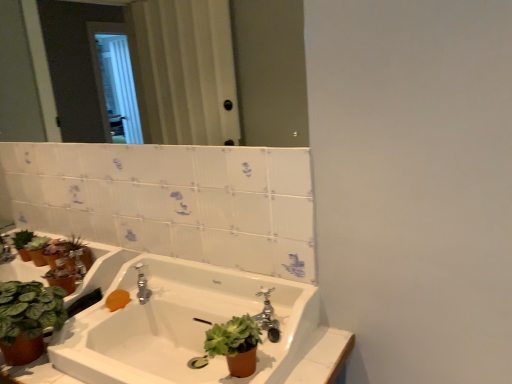
Image resolution: width=512 pixels, height=384 pixels. In order to click on green matte succulent at lower center in this screenshot , I will do `click(232, 345)`.

What are the coordinates of `orange matte soap at lower left` in the screenshot? It's located at (117, 300).

Who is shorter, white glossy sink at center or green matte succulent at lower center?

Standing shorter between the two is green matte succulent at lower center.

From a real-world perspective, which object rests below the other?

white glossy sink at center, from a real-world perspective.

Between white glossy sink at center and green matte succulent at lower center, which one has smaller width?

green matte succulent at lower center.

From a real-world perspective, does green matte succulent at lower center sit lower than orange matte soap at lower left?

No, from a real-world perspective, green matte succulent at lower center is not under orange matte soap at lower left.

Can you confirm if green matte succulent at lower center is wider than orange matte soap at lower left?

Yes, green matte succulent at lower center is wider than orange matte soap at lower left.

Does green matte succulent at lower center lie behind orange matte soap at lower left?

Result: No, it is in front of orange matte soap at lower left.

Which point is more distant from viewer, (234, 318) or (121, 302)?

The point (121, 302) is farther.

In terms of size, does orange matte soap at lower left appear bigger or smaller than clear glass mirror at upper center?

Clearly, orange matte soap at lower left is smaller in size than clear glass mirror at upper center.

Considering the points (106, 306) and (25, 129), which point is in front, point (106, 306) or point (25, 129)?

Positioned in front is point (106, 306).

Image resolution: width=512 pixels, height=384 pixels. What are the coordinates of `soap located below the clear glass mirror at upper center (from the image's perspective)` in the screenshot? It's located at (117, 300).

Between orange matte soap at lower left and silver metallic faucet at center, which one has smaller size?

orange matte soap at lower left.

From a real-world perspective, which object rests below the other?

From a 3D spatial view, orange matte soap at lower left is below.

Between orange matte soap at lower left and silver metallic faucet at center, which one has larger width?

Wider between the two is silver metallic faucet at center.

Which is in front, point (112, 306) or point (143, 288)?

The point (112, 306) is in front.

Does point (106, 362) appear closer or farther from the camera than point (106, 305)?

Point (106, 362) is closer to the camera than point (106, 305).

In order to click on soap on the left side of white glossy sink at center in this screenshot , I will do `click(117, 300)`.

Is white glossy sink at center positioned beyond the bounds of orange matte soap at lower left?

Indeed, white glossy sink at center is completely outside orange matte soap at lower left.

From the picture: Is white glossy sink at center to the right of orange matte soap at lower left from the viewer's perspective?

Indeed, white glossy sink at center is positioned on the right side of orange matte soap at lower left.

Considering the relative sizes of silver metallic faucet at center and green matte succulent at lower center in the image provided, is silver metallic faucet at center smaller than green matte succulent at lower center?

Indeed, silver metallic faucet at center has a smaller size compared to green matte succulent at lower center.

Which is more to the left, silver metallic faucet at center or green matte succulent at lower center?

Positioned to the left is silver metallic faucet at center.

Considering the positions of points (145, 286) and (234, 321), is point (145, 286) closer to camera compared to point (234, 321)?

That is False.

Is silver metallic faucet at center next to green matte succulent at lower center and touching it?

No, silver metallic faucet at center is not touching green matte succulent at lower center.

Find the location of a particular element. The height and width of the screenshot is (384, 512). sink below the silver metallic faucet at center (from a real-world perspective) is located at coordinates (182, 326).

Considering the relative sizes of silver metallic faucet at center and white glossy sink at center in the image provided, is silver metallic faucet at center bigger than white glossy sink at center?

Incorrect, silver metallic faucet at center is not larger than white glossy sink at center.

Is white glossy sink at center completely or partially inside silver metallic faucet at center?

No, white glossy sink at center is not inside silver metallic faucet at center.

Looking at this image, from the image's perspective, would you say silver metallic faucet at center is shown under white glossy sink at center?

Actually, silver metallic faucet at center appears above white glossy sink at center in the image.

I want to click on houseplant on the right of the white glossy sink at center, so click(x=232, y=345).

Find the location of a particular element. The width and height of the screenshot is (512, 384). soap located above the green matte succulent at lower center (from the image's perspective) is located at coordinates (117, 300).

Based on their spatial positions, is silver metallic faucet at center or white glossy sink at center closer to orange matte soap at lower left?

The object closer to orange matte soap at lower left is silver metallic faucet at center.

Based on their spatial positions, is clear glass mirror at upper center or silver metallic faucet at center further from white glossy sink at center?

clear glass mirror at upper center is further to white glossy sink at center.

When comparing their distances from white glossy sink at center, does orange matte soap at lower left or green matte succulent at lower center seem further?

The object further to white glossy sink at center is green matte succulent at lower center.

Which object lies nearer to the anchor point clear glass mirror at upper center, orange matte soap at lower left or green matte succulent at lower center?

green matte succulent at lower center.

Looking at the image, which one is located closer to silver metallic faucet at center, green matte succulent at lower center or white glossy sink at center?

The object closer to silver metallic faucet at center is white glossy sink at center.

Looking at the image, which one is located further to green matte succulent at lower center, clear glass mirror at upper center or white glossy sink at center?

clear glass mirror at upper center.

From the image, which object appears to be nearer to white glossy sink at center, silver metallic faucet at center or green matte succulent at lower center?

silver metallic faucet at center is positioned closer to the anchor white glossy sink at center.

Which object lies further to the anchor point white glossy sink at center, green matte succulent at lower center or clear glass mirror at upper center?

clear glass mirror at upper center lies further to white glossy sink at center than the other object.

Find the location of a particular element. tap that lies between clear glass mirror at upper center and white glossy sink at center from top to bottom is located at coordinates (142, 285).

You are a GUI agent. You are given a task and a screenshot of the screen. Output one action in this format:
    pyautogui.click(x=<x>, y=<y>)
    Task: Click on the soap that lies between clear glass mirror at upper center and green matte succulent at lower center from top to bottom
    Image resolution: width=512 pixels, height=384 pixels.
    Given the screenshot: What is the action you would take?
    pyautogui.click(x=117, y=300)

In order to click on houseplant located between white glossy sink at center and silver metallic faucet at center in the depth direction in this screenshot , I will do `click(232, 345)`.

This screenshot has height=384, width=512. In order to click on tap between green matte succulent at lower center and orange matte soap at lower left along the z-axis in this screenshot , I will do `click(142, 285)`.